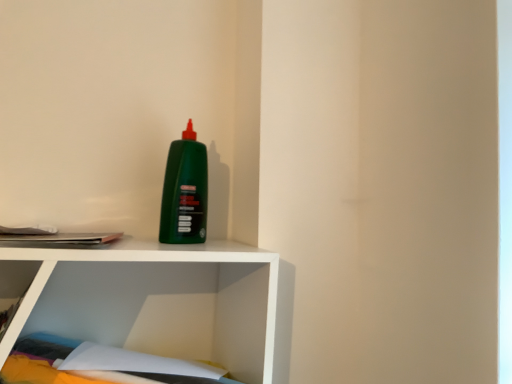
Question: Should I look upward or downward to see green matte bottle at center?

Choices:
 (A) down
 (B) up

Answer: (B)